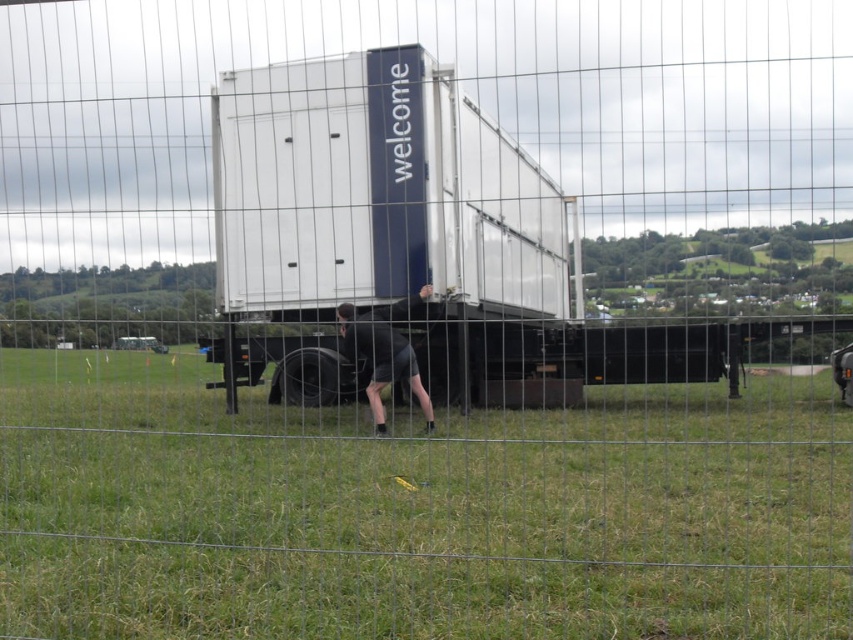
You are standing at the edge of the grassy field and want to approach the white matte truck at center. To avoid stepping on the black matte shorts at lower center, which are you supposed to walk around to reach the truck?

To reach the white matte truck at center without stepping on the black matte shorts at lower center, you should walk around to the left side of the black matte shorts at lower center since the truck is positioned on the right side of the shorts.

You are standing at the point with coordinates point (393, 310) and want to walk to the point (32, 513). According to the scene, will you have to go around any obstacles between these two points?

Point (32, 513) is in front of point (393, 310), so you can walk directly towards it without needing to go around any obstacles between them.

You are a photographer setting up a shot of the scene. You need to ensure that the green grass at lower center and the black matte shorts at lower center are both visible in the frame. Which object should you focus on first to make sure both are in focus?

Since the green grass at lower center is below the black matte shorts at lower center, you should focus on the black matte shorts at lower center first as it is closer to the camera. This ensures both objects will be in focus due to the overlapping depth of field.